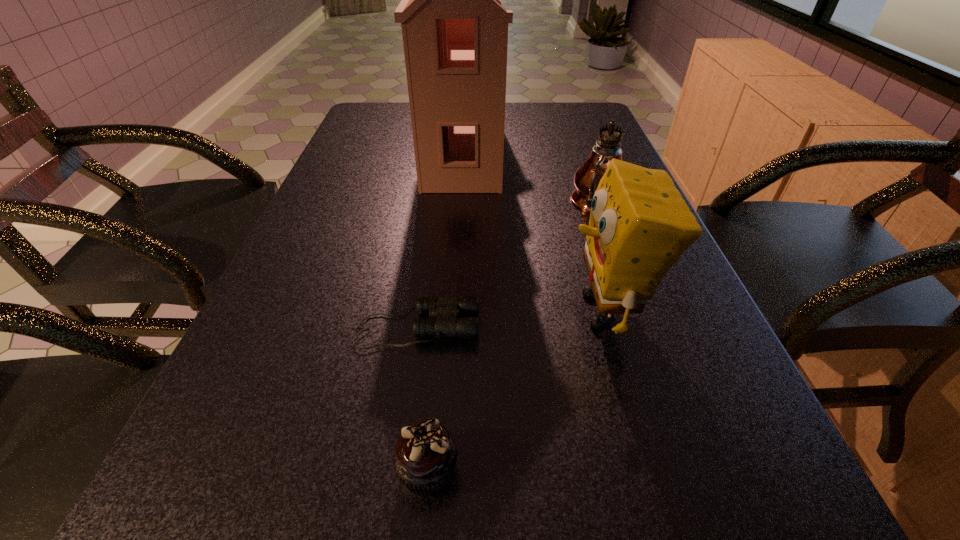
Locate an element on the screen. free region located on the face of the third shortest object is located at coordinates (364, 310).

Locate an element on the screen. free spot located 0.080m on the right of the cupcake is located at coordinates (521, 470).

Where is `vacant region located 0.190m at the eyepiece of the binoculars`? This screenshot has width=960, height=540. vacant region located 0.190m at the eyepiece of the binoculars is located at coordinates (591, 327).

I want to click on object located in the far edge section of the desktop, so click(x=455, y=31).

Locate an element on the screen. oil lamp positioned at the right edge is located at coordinates [615, 114].

I want to click on sponge that is at the right edge, so click(639, 226).

You are a GUI agent. You are given a task and a screenshot of the screen. Output one action in this format:
    pyautogui.click(x=<x>, y=<y>)
    Task: Click on the free space at the far edge of the desktop
    
    Given the screenshot: What is the action you would take?
    pyautogui.click(x=524, y=131)

Find the location of a particular element. Image resolution: width=960 pixels, height=540 pixels. vacant space at the left edge of the desktop is located at coordinates (354, 167).

Where is `free space at the right edge`? free space at the right edge is located at coordinates (682, 271).

Image resolution: width=960 pixels, height=540 pixels. I want to click on free location at the far left corner, so click(381, 113).